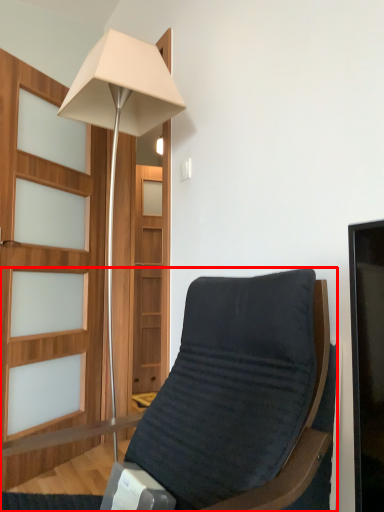
Question: Where is chair (annotated by the red box) located in relation to lamp in the image?

Choices:
 (A) left
 (B) right

Answer: (B)